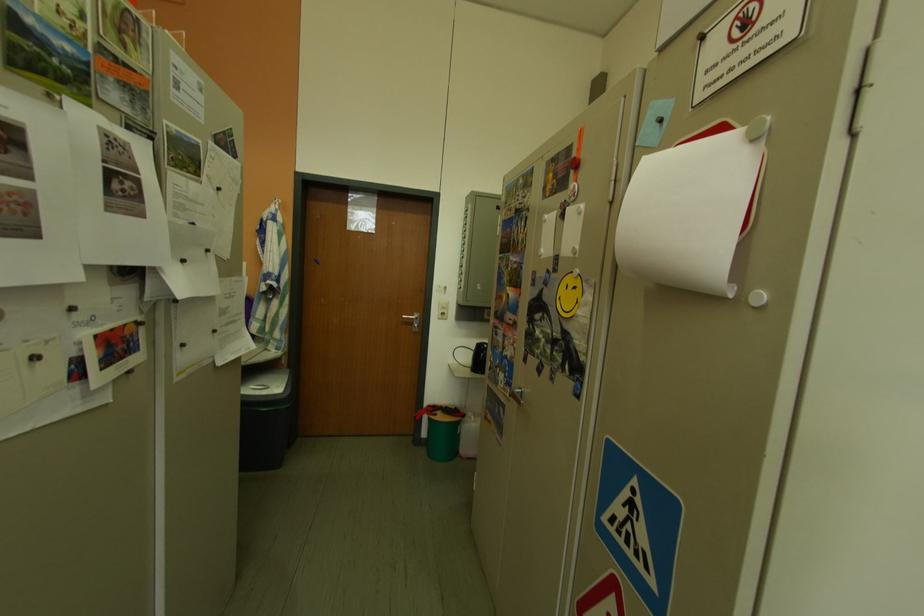
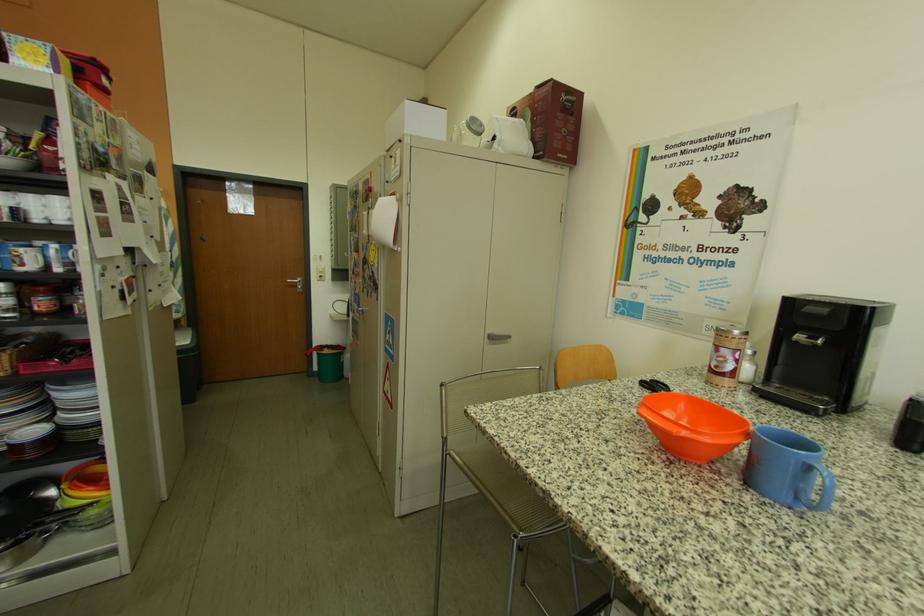
Where in the second image is the point corresponding to pixel 442 421 from the first image?

(331, 357)